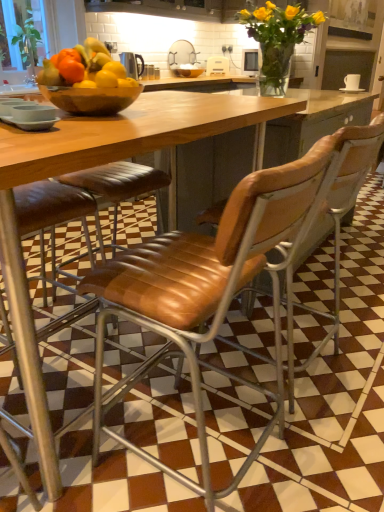
Image resolution: width=384 pixels, height=512 pixels. What do you see at coordinates (132, 64) in the screenshot? I see `metallic silver kettle at center` at bounding box center [132, 64].

Where is `yellow matte vase at upper center, placed as the 1th flower when sorted from top to bottom`? yellow matte vase at upper center, placed as the 1th flower when sorted from top to bottom is located at coordinates (279, 23).

What is the approximate width of yellow glass vase at upper center, arranged as the first flower when ordered from the bottom?

The width of yellow glass vase at upper center, arranged as the first flower when ordered from the bottom, is 19.00 inches.

The width and height of the screenshot is (384, 512). Find the location of `leather seat at center, the 2th chair positioned from the left`. leather seat at center, the 2th chair positioned from the left is located at coordinates (335, 227).

In the scene shown: Does leather seat at center, the 2th chair positioned from the left, have a lesser width compared to brown leather chair at center, which is the 2th chair from right to left?

Indeed, leather seat at center, the 2th chair positioned from the left, has a lesser width compared to brown leather chair at center, which is the 2th chair from right to left.

Is brown leather chair at center, the first chair from the left, a part of leather seat at center, placed as the first chair when sorted from right to left?

No, brown leather chair at center, the first chair from the left, is located outside of leather seat at center, placed as the first chair when sorted from right to left.

The height and width of the screenshot is (512, 384). Find the location of `chair on the right of brown leather chair at center, the first chair from the left`. chair on the right of brown leather chair at center, the first chair from the left is located at coordinates (335, 227).

You are a GUI agent. You are given a task and a screenshot of the screen. Output one action in this format:
    pyautogui.click(x=<x>, y=<y>)
    Task: Click on the 2nd flower to the right of the metallic silver kettle at center, counting from the anchor's position
    
    Given the screenshot: What is the action you would take?
    279,23

Is metallic silver kettle at center completely or partially outside of yellow matte vase at upper center, positioned as the 2th flower in front-to-back order?

Yes, metallic silver kettle at center is located beyond the bounds of yellow matte vase at upper center, positioned as the 2th flower in front-to-back order.

Is metallic silver kettle at center positioned far away from yellow matte vase at upper center, which is the 2th flower in bottom-to-top order?

metallic silver kettle at center is positioned a significant distance from yellow matte vase at upper center, which is the 2th flower in bottom-to-top order.

Considering the relative sizes of metallic silver kettle at center and yellow matte vase at upper center, which is the 2th flower in bottom-to-top order, in the image provided, is metallic silver kettle at center taller than yellow matte vase at upper center, which is the 2th flower in bottom-to-top order,?

In fact, metallic silver kettle at center may be shorter than yellow matte vase at upper center, which is the 2th flower in bottom-to-top order.

From a real-world perspective, is yellow matte vase at upper center, which is the 2th flower in bottom-to-top order, physically located above or below wooden bowl at center?

Clearly, from a real-world perspective, yellow matte vase at upper center, which is the 2th flower in bottom-to-top order, is above wooden bowl at center.

Is yellow matte vase at upper center, the 1th flower in the back-to-front sequence, outside of wooden bowl at center?

yellow matte vase at upper center, the 1th flower in the back-to-front sequence, lies outside wooden bowl at center's area.

Is yellow matte vase at upper center, placed as the 1th flower when sorted from top to bottom, next to wooden bowl at center and touching it?

No, yellow matte vase at upper center, placed as the 1th flower when sorted from top to bottom, is not next to wooden bowl at center.

Is yellow matte vase at upper center, positioned as the 2th flower in front-to-back order, positioned with its back to wooden bowl at center?

No.

From a real-world perspective, is transparent glass bowl at center below leather seat at center, the 2th chair positioned from the left?

No.

Considering the relative positions of transparent glass bowl at center and leather seat at center, the 2th chair positioned from the left, in the image provided, is transparent glass bowl at center to the right of leather seat at center, the 2th chair positioned from the left, from the viewer's perspective?

No, transparent glass bowl at center is not to the right of leather seat at center, the 2th chair positioned from the left.

From the image's perspective, which is below, transparent glass bowl at center or leather seat at center, the 2th chair positioned from the left?

leather seat at center, the 2th chair positioned from the left, is shown below in the image.

Between transparent glass bowl at center and leather seat at center, placed as the first chair when sorted from right to left, which one has smaller width?

transparent glass bowl at center.

Is the depth of wooden bowl at center greater than that of transparent glass bowl at center?

No, wooden bowl at center is in front of transparent glass bowl at center.

Is wooden bowl at center next to transparent glass bowl at center?

No, wooden bowl at center is not beside transparent glass bowl at center.

Considering the sizes of objects wooden bowl at center and transparent glass bowl at center in the image provided, who is bigger, wooden bowl at center or transparent glass bowl at center?

Bigger between the two is transparent glass bowl at center.

Measure the distance between leather seat at center, placed as the first chair when sorted from right to left, and metallic silver kettle at center.

leather seat at center, placed as the first chair when sorted from right to left, and metallic silver kettle at center are 2.73 meters apart.

Is leather seat at center, placed as the first chair when sorted from right to left, inside or outside of metallic silver kettle at center?

leather seat at center, placed as the first chair when sorted from right to left, is located beyond the bounds of metallic silver kettle at center.

Which object is more forward, leather seat at center, placed as the first chair when sorted from right to left, or metallic silver kettle at center?

leather seat at center, placed as the first chair when sorted from right to left, is more forward.

Based on the photo, how many degrees apart are the facing directions of leather seat at center, the 2th chair positioned from the left, and metallic silver kettle at center?

leather seat at center, the 2th chair positioned from the left, and metallic silver kettle at center are facing 177 degrees away from each other.

Based on the photo, is metallic silver kettle at center facing towards wooden bowl at center?

No, metallic silver kettle at center is not aimed at wooden bowl at center.

Considering the relative sizes of metallic silver kettle at center and wooden bowl at center in the image provided, is metallic silver kettle at center bigger than wooden bowl at center?

Indeed, metallic silver kettle at center has a larger size compared to wooden bowl at center.

Which is nearer, (135, 56) or (89, 108)?

Point (89, 108)

From the image's perspective, is metallic silver kettle at center above or below wooden bowl at center?

metallic silver kettle at center is above wooden bowl at center.

The image size is (384, 512). I want to click on chair located underneath the leather seat at center, placed as the first chair when sorted from right to left (from a real-world perspective), so click(208, 291).

Identify the location of appliance on the left of yellow matte vase at upper center, the 1th flower in the back-to-front sequence. (132, 64).

Looking at the image, which one is located further to brown leather chair at center, the first chair from the left, wooden bowl at center or transparent glass bowl at center?

transparent glass bowl at center lies further to brown leather chair at center, the first chair from the left, than the other object.

Based on the photo, which object lies nearer to the anchor point metallic silver kettle at center, leather seat at center, the 2th chair positioned from the left, or yellow matte vase at upper center, placed as the 1th flower when sorted from top to bottom?

Among the two, yellow matte vase at upper center, placed as the 1th flower when sorted from top to bottom, is located nearer to metallic silver kettle at center.

Which object lies further to the anchor point wooden bowl at center, yellow glass vase at upper center, arranged as the first flower when ordered from the bottom, or brown leather chair at center, the first chair from the left?

The object further to wooden bowl at center is yellow glass vase at upper center, arranged as the first flower when ordered from the bottom.

From the image, which object appears to be farther from yellow matte vase at upper center, which is the 2th flower in bottom-to-top order, brown leather chair at center, which is the 2th chair from right to left, or leather seat at center, placed as the first chair when sorted from right to left?

Based on the image, brown leather chair at center, which is the 2th chair from right to left, appears to be further to yellow matte vase at upper center, which is the 2th flower in bottom-to-top order.

Looking at the image, which one is located closer to yellow matte vase at upper center, which is the 2th flower in bottom-to-top order, yellow glass vase at upper center, which is the second flower in top-to-bottom order, or wooden bowl at center?

Among the two, yellow glass vase at upper center, which is the second flower in top-to-bottom order, is located nearer to yellow matte vase at upper center, which is the 2th flower in bottom-to-top order.

From the image, which object appears to be nearer to yellow matte vase at upper center, which is the 2th flower in bottom-to-top order, wooden bowl at center or yellow glass vase at upper center, which ranks as the second flower in back-to-front order?

yellow glass vase at upper center, which ranks as the second flower in back-to-front order, is closer to yellow matte vase at upper center, which is the 2th flower in bottom-to-top order.

Looking at the image, which one is located further to yellow matte vase at upper center, placed as the 1th flower when sorted from top to bottom, yellow glass vase at upper center, the 1th flower viewed from the front, or brown leather chair at center, which is the 2th chair from right to left?

Based on the image, brown leather chair at center, which is the 2th chair from right to left, appears to be further to yellow matte vase at upper center, placed as the 1th flower when sorted from top to bottom.

Estimate the real-world distances between objects in this image. Which object is closer to metallic silver kettle at center, yellow glass vase at upper center, which is the second flower in top-to-bottom order, or yellow matte vase at upper center, the 1th flower in the back-to-front sequence?

yellow matte vase at upper center, the 1th flower in the back-to-front sequence.

You are a GUI agent. You are given a task and a screenshot of the screen. Output one action in this format:
    pyautogui.click(x=<x>, y=<y>)
    Task: Click on the flower between yellow glass vase at upper center, which ranks as the second flower in back-to-front order, and transparent glass bowl at center in the front-back direction
    
    Given the screenshot: What is the action you would take?
    pyautogui.click(x=279, y=23)

This screenshot has width=384, height=512. I want to click on appliance between wooden bowl at center and transparent glass bowl at center in the front-back direction, so click(x=132, y=64).

Find the location of a particular element. The width and height of the screenshot is (384, 512). bowl between leather seat at center, placed as the first chair when sorted from right to left, and yellow matte vase at upper center, which is the 2th flower in bottom-to-top order, in the front-back direction is located at coordinates (91, 99).

Locate an element on the screen. This screenshot has height=512, width=384. flower positioned between leather seat at center, placed as the first chair when sorted from right to left, and yellow matte vase at upper center, positioned as the 2th flower in front-to-back order, from near to far is located at coordinates [x=278, y=36].